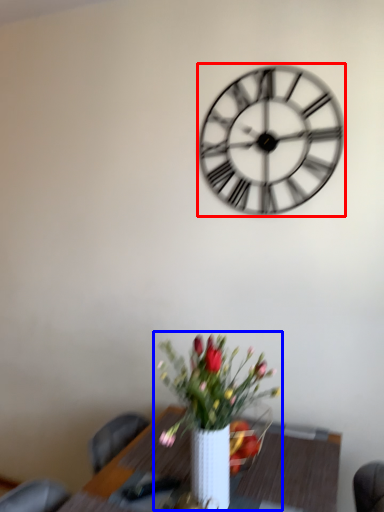
Question: Which of the following is the farthest to the observer, wall clock (highlighted by a red box) or houseplant (highlighted by a blue box)?

Choices:
 (A) wall clock
 (B) houseplant

Answer: (A)